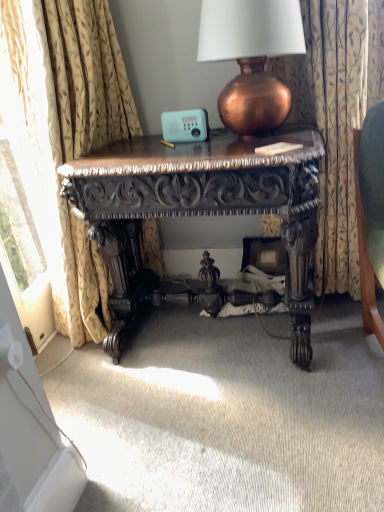
Question: Is gold floral fabric curtain at left, the 2th curtain from the right, wider or thinner than polished dark wood desk at center?

Choices:
 (A) thin
 (B) wide

Answer: (A)

Question: Based on their positions, is gold floral fabric curtain at left, which is the first curtain in left-to-right order, located to the left or right of polished dark wood desk at center?

Choices:
 (A) left
 (B) right

Answer: (A)

Question: Estimate the real-world distances between objects in this image. Which object is closer to the copper metallic lamp at upper center?

Choices:
 (A) gold floral fabric curtain at left, which is the first curtain in left-to-right order
 (B) polished dark wood desk at center
 (C) floral fabric curtain at right, the 2th curtain in the left-to-right sequence

Answer: (C)

Question: Estimate the real-world distances between objects in this image. Which object is farther from the polished dark wood desk at center?

Choices:
 (A) gold floral fabric curtain at left, the 2th curtain from the right
 (B) floral fabric curtain at right, the 2th curtain in the left-to-right sequence
 (C) copper metallic lamp at upper center

Answer: (B)